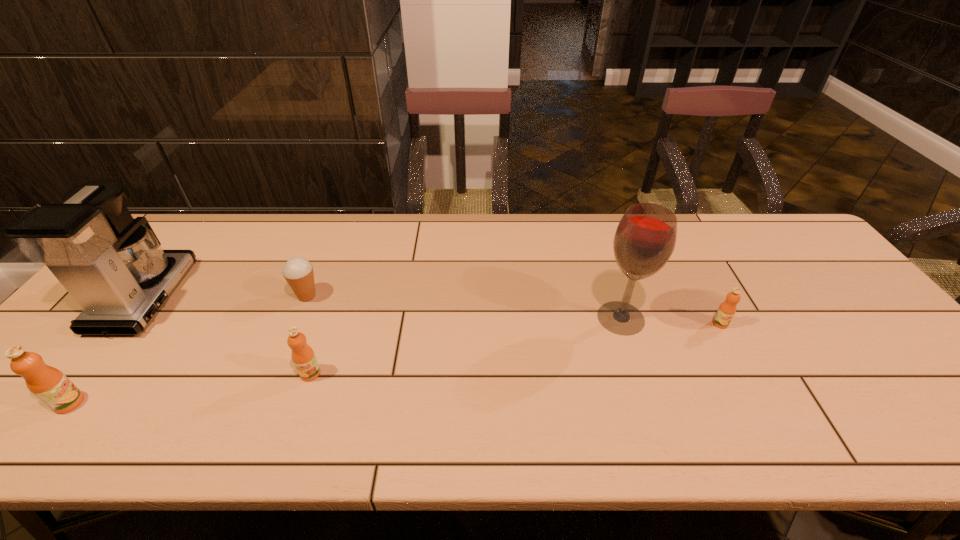
Identify the location of vacant space at the far right corner of the desktop. The height and width of the screenshot is (540, 960). (780, 220).

Where is `free spot between the coffee maker and the tallest orange juice`? free spot between the coffee maker and the tallest orange juice is located at coordinates (108, 350).

Locate an element on the screen. vacant area between the fourth object from left to right and the rightmost object is located at coordinates [x=516, y=348].

You are a GUI agent. You are given a task and a screenshot of the screen. Output one action in this format:
    pyautogui.click(x=<x>, y=<y>)
    Task: Click on the unoccupied position between the coffee maker and the third object from left to right
    This screenshot has width=960, height=540.
    Given the screenshot: What is the action you would take?
    pyautogui.click(x=226, y=296)

Image resolution: width=960 pixels, height=540 pixels. Find the location of `vacant space that's between the fourth object from right to left and the coffee maker`. vacant space that's between the fourth object from right to left and the coffee maker is located at coordinates (226, 296).

You are a GUI agent. You are given a task and a screenshot of the screen. Output one action in this format:
    pyautogui.click(x=<x>, y=<y>)
    Task: Click on the empty space between the rightmost object and the alcohol
    The image size is (960, 540).
    Given the screenshot: What is the action you would take?
    pyautogui.click(x=670, y=321)

This screenshot has width=960, height=540. Find the location of `free space between the second nearest object and the icecream`. free space between the second nearest object and the icecream is located at coordinates (309, 335).

The image size is (960, 540). What are the coordinates of `free space between the second nearest orange juice and the third object from left to right` in the screenshot? It's located at (309, 335).

Find the location of `free space that is in between the second object from right to left and the second nearest object`. free space that is in between the second object from right to left and the second nearest object is located at coordinates (466, 346).

Identify the location of vacant area that lies between the icecream and the third tallest object. The width and height of the screenshot is (960, 540). (188, 349).